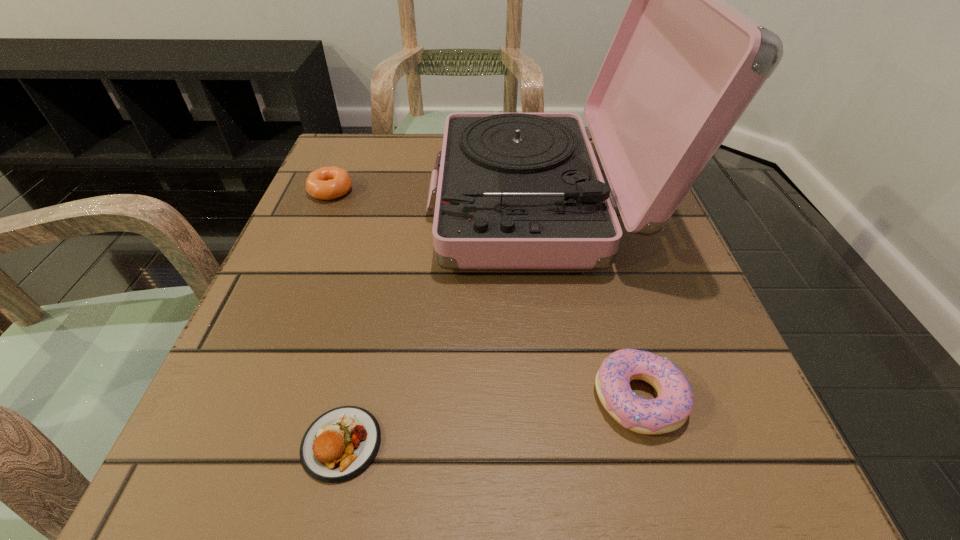
In order to click on vacant space that satisfies the following two spatial constraints: 1. on the back side of the right doughnut; 2. with the lid open on the tallest object in this screenshot , I will do `click(584, 202)`.

In order to click on vacant space that satisfies the following two spatial constraints: 1. with the lid open on the record player; 2. on the right side of the nearer doughnut in this screenshot , I will do `click(573, 398)`.

Identify the location of blank area in the image that satisfies the following two spatial constraints: 1. with the lid open on the right doughnut; 2. on the right side of the record player. Image resolution: width=960 pixels, height=540 pixels. (573, 398).